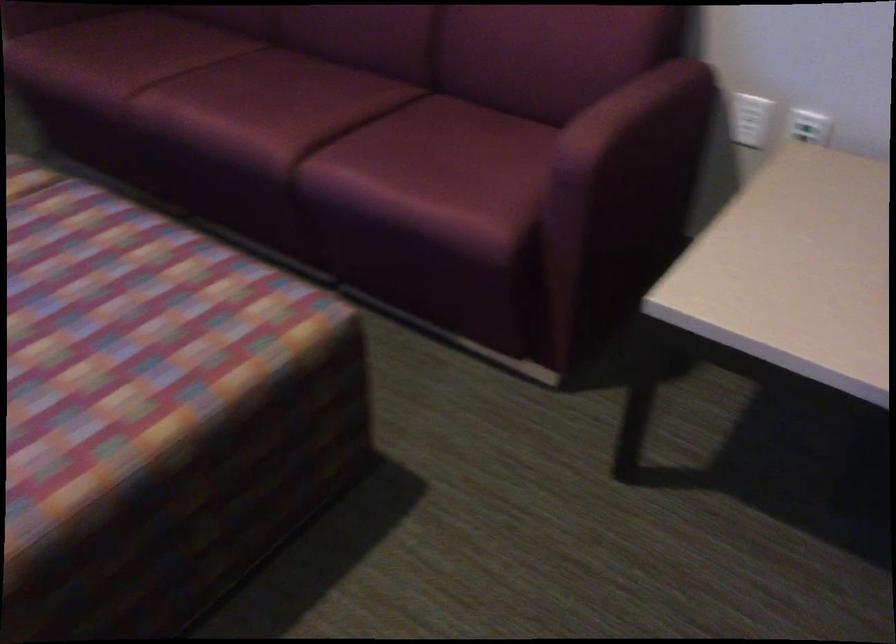
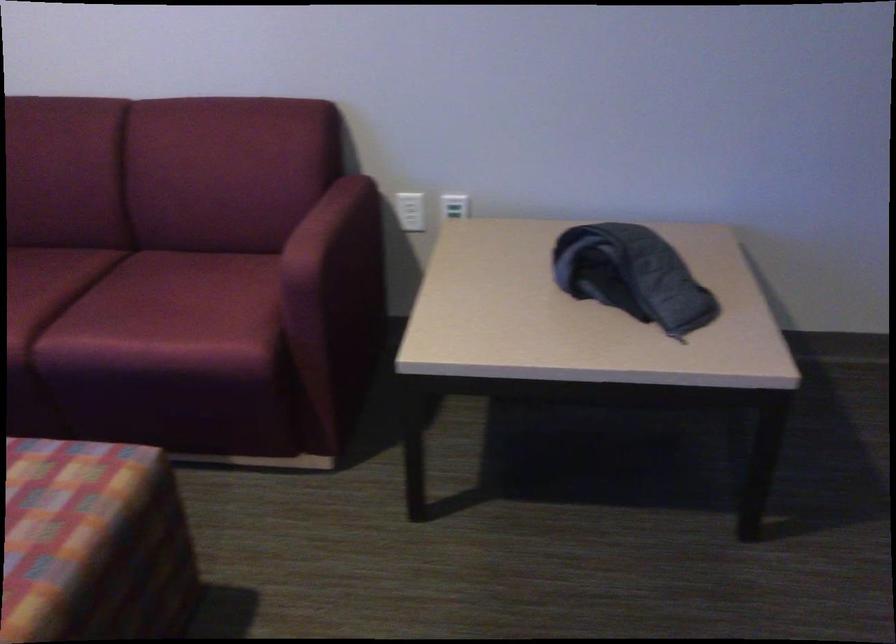
The point at (622, 160) is marked in the first image. Where is the corresponding point in the second image?

(334, 259)